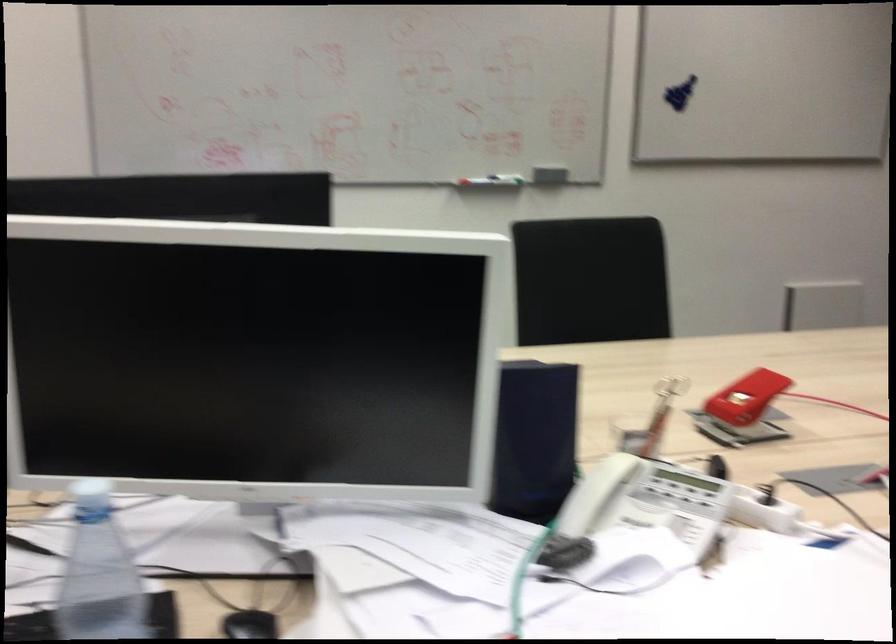
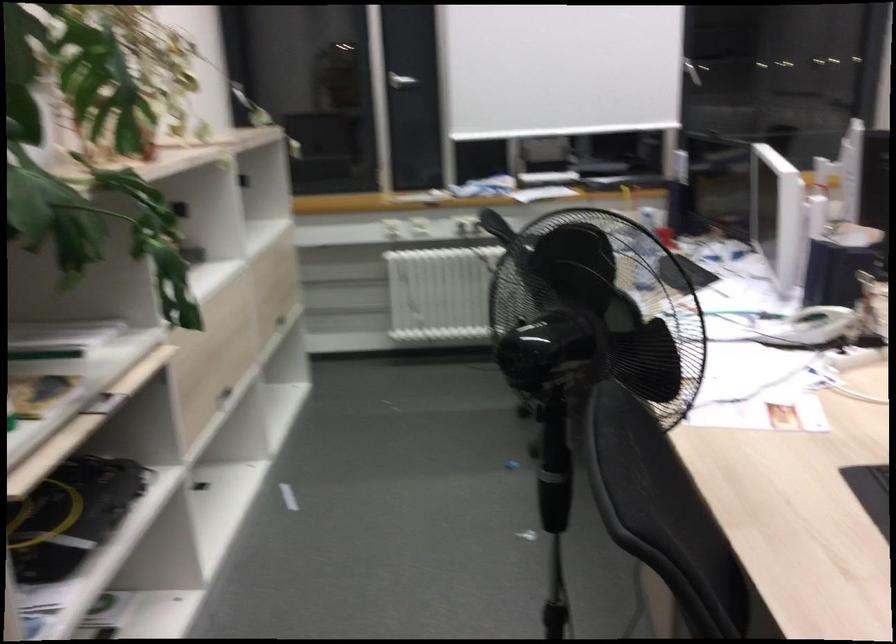
Where in the second image is the point corresponding to [669,515] from the first image?

(811, 327)